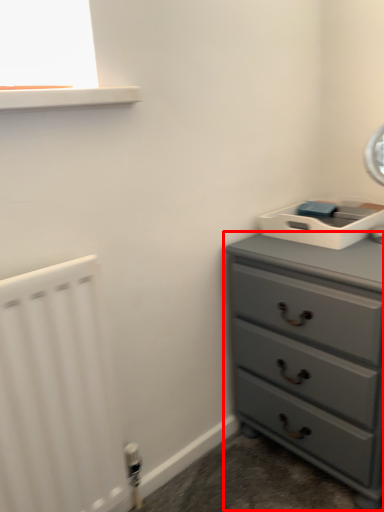
Question: From the image's perspective, where is chest of drawers (annotated by the red box) located in relation to radiator in the image?

Choices:
 (A) below
 (B) above

Answer: (B)